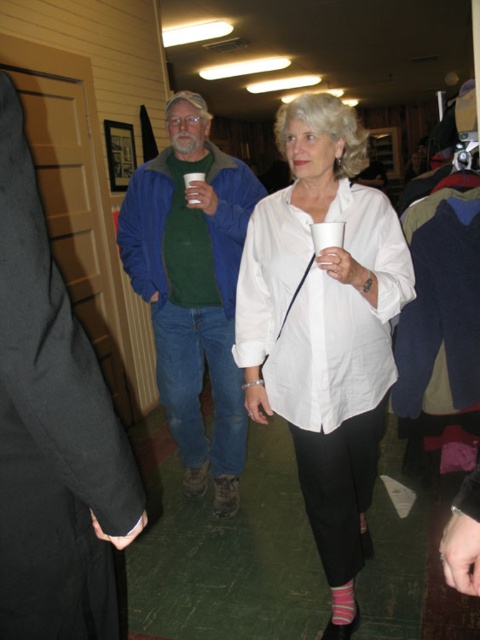
You are standing in the hallway and need to pick up an item that is closer to you. Which item should you choose between the blue fleece jacket at center and the pink striped sock at lower center?

The pink striped sock at lower center is closer to you since it is only 1.24 meters away from the blue fleece jacket at center, but since the question is about which is closer to you, we need to determine your position. Wait, the description says the blue fleece jacket is 1.24 meters away from the pink striped sock. Without knowing your exact position, it is impossible to determine which is closer. However, if you are positioned such that both are in front of you, the pink striped sock at lower center might

You are standing in the hallway and see a point marked at coordinates (324,321). What object is located at that point?

The point at (324,321) corresponds to the white matte shirt at center.

You are standing in the hallway and want to grab the white paper cup at center. However, there is a person in the way wearing a white matte shirt at center. Can you reach the cup without moving the person?

The white matte shirt at center is positioned under the white paper cup at center, meaning the cup is above the shirt. Since the shirt is worn by a person standing in the way, you would need to ask them to move or reach around them to access the cup.